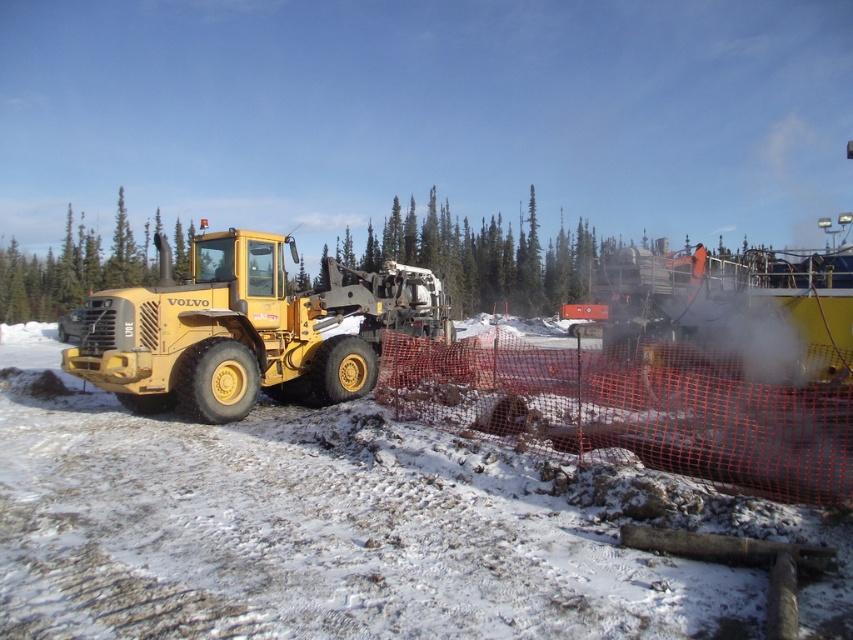
This screenshot has height=640, width=853. What are the coordinates of `matte yellow tractor at left` in the screenshot? It's located at (247, 330).

This screenshot has width=853, height=640. In order to click on matte yellow tractor at left in this screenshot , I will do [x=247, y=330].